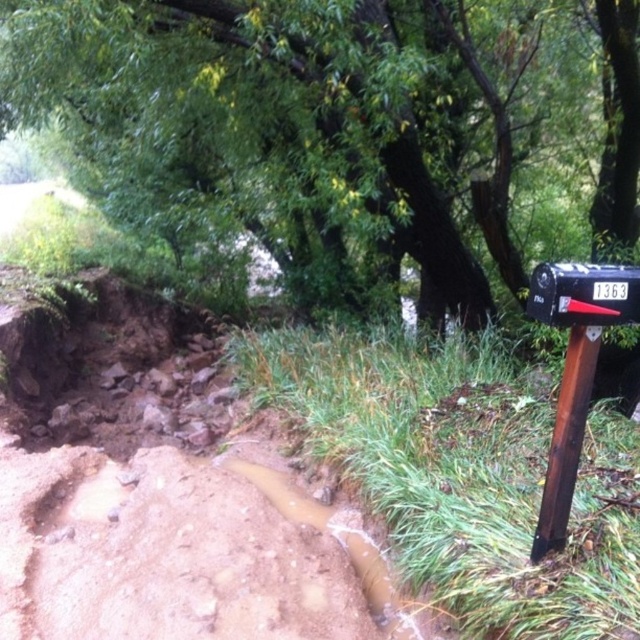
You are standing at the mailbox on the right side of the frame. Looking towards the green leafy tree at upper center, which direction should you face to see it?

The green leafy tree at upper center is located at point (280, 124), so you should face towards the upper center direction to see it.

You are a surveyor assessing flood damage. You see a green leafy tree at upper center and a brown wooden post at right. Which object is taller?

The green leafy tree at upper center is much taller than the brown wooden post at right.